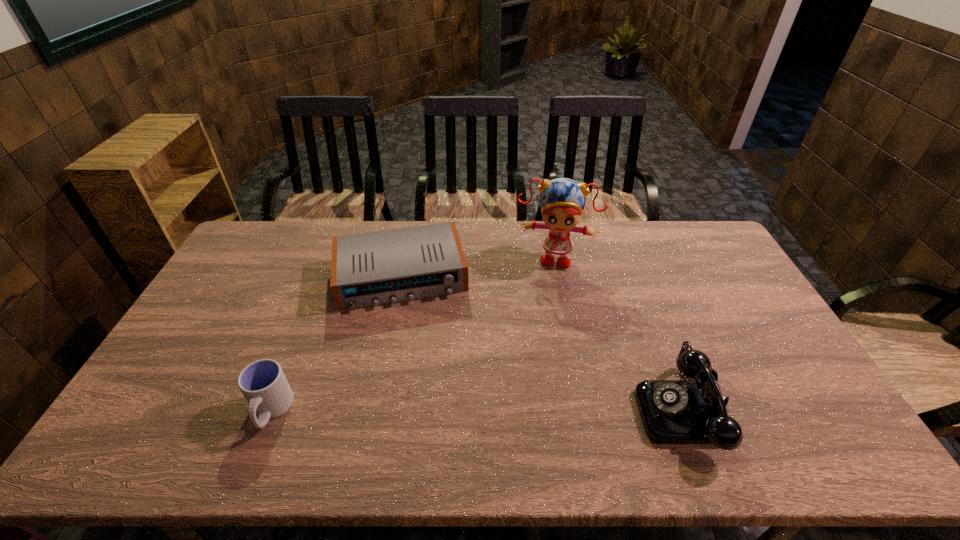
In the image, there is a desktop. Identify the location of free space at the far right corner. (687, 245).

Locate an element on the screen. empty space between the cup and the radio receiver is located at coordinates (336, 343).

This screenshot has width=960, height=540. Identify the location of unoccupied position between the cup and the telephone. (477, 410).

This screenshot has width=960, height=540. Identify the location of vacant point located between the radio receiver and the telephone. (542, 343).

Identify the location of vacant space that's between the telephone and the tallest object. Image resolution: width=960 pixels, height=540 pixels. (619, 332).

This screenshot has width=960, height=540. What are the coordinates of `free space between the doll and the shortest object` in the screenshot? It's located at (478, 266).

Locate an element on the screen. The image size is (960, 540). free spot between the doll and the shortest object is located at coordinates pyautogui.click(x=478, y=266).

At what (x,y) coordinates should I click in order to perform the action: click on free space between the radio receiver and the cup. Please return your answer as a coordinate pair (x, y). This screenshot has width=960, height=540. Looking at the image, I should click on point(336,343).

The width and height of the screenshot is (960, 540). What are the coordinates of `vacant point located between the cup and the radio receiver` in the screenshot? It's located at (336, 343).

Where is `free area in between the cup and the telephone`? The width and height of the screenshot is (960, 540). free area in between the cup and the telephone is located at coordinates (477, 410).